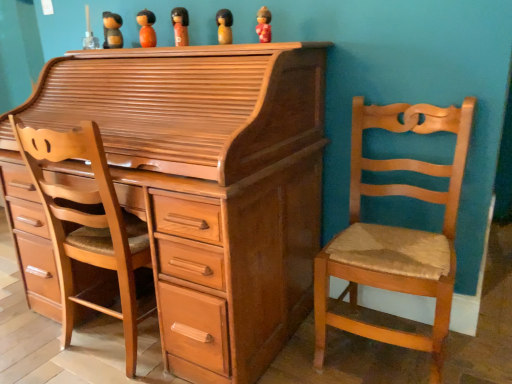
Question: From a real-world perspective, is matte orange doll at center, the 3th toy from the left, positioned above or below wooden figurine at upper center, which is the 1th toy in left-to-right order?

Choices:
 (A) below
 (B) above

Answer: (A)

Question: Choose the correct answer: Is matte orange doll at center, placed as the third toy when sorted from right to left, inside wooden figurine at upper center, which is the 1th toy in left-to-right order, or outside it?

Choices:
 (A) inside
 (B) outside

Answer: (B)

Question: Which of these objects is positioned closest to the matte orange doll at center, placed as the third toy when sorted from right to left?

Choices:
 (A) wooden figurine at upper center, the 5th toy in the right-to-left sequence
 (B) light brown wood chair at right
 (C) light brown wood chest of drawers at center
 (D) wooden figurine at upper center, arranged as the fourth toy when viewed from the left
 (E) orange matte wooden doll at upper center, the second toy when ordered from left to right

Answer: (D)

Question: Which is nearer to the matte red figurine at upper center, which ranks as the fifth toy in left-to-right order?

Choices:
 (A) light brown wood chest of drawers at center
 (B) light brown wood swivel chair at left
 (C) matte orange doll at center, the 3th toy from the left
 (D) light brown wood chair at right
 (E) wooden figurine at upper center, the 5th toy in the right-to-left sequence

Answer: (C)